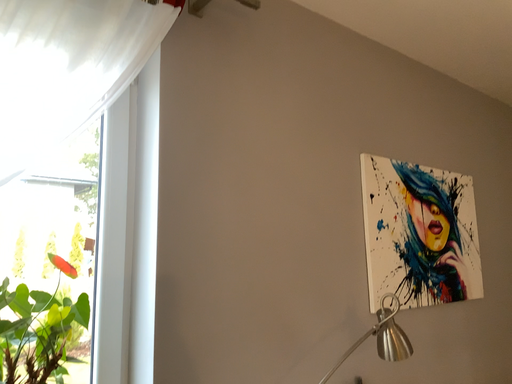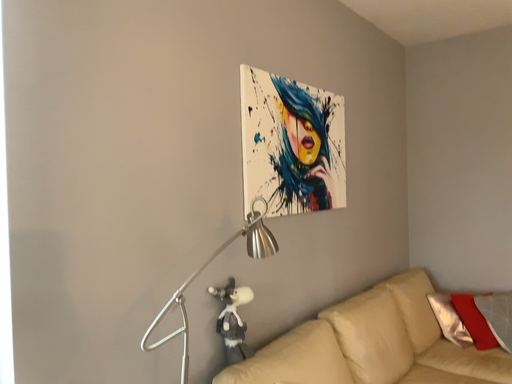
Question: Which way did the camera rotate in the video?

Choices:
 (A) rotated downward
 (B) rotated upward

Answer: (A)